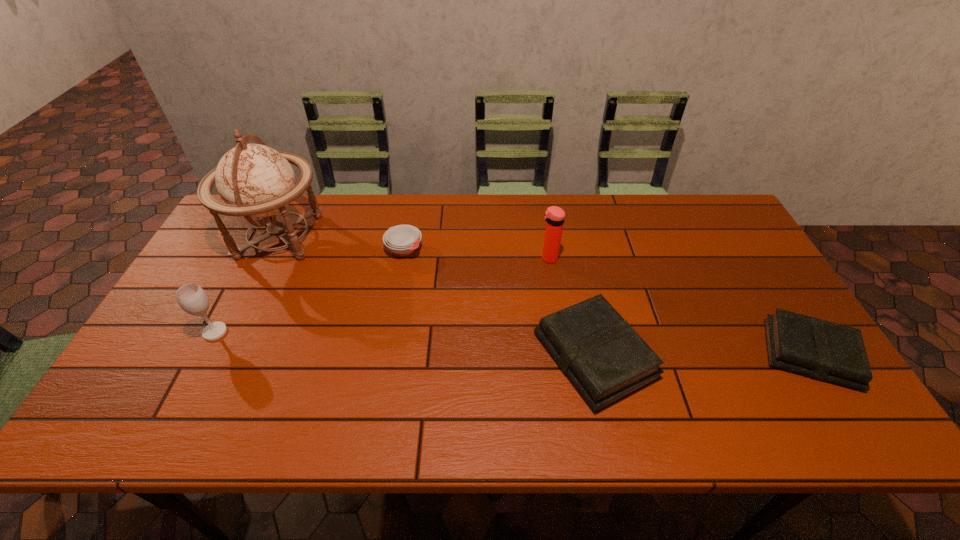
The books are evenly distributed in the image. To maintain this, where would you place another book on the left? Please point to a free space. Please provide its 2D coordinates. Your answer should be formatted as a tuple, i.e. [(x, y)], where the tuple contains the x and y coordinates of a point satisfying the conditions above.

[(377, 358)]